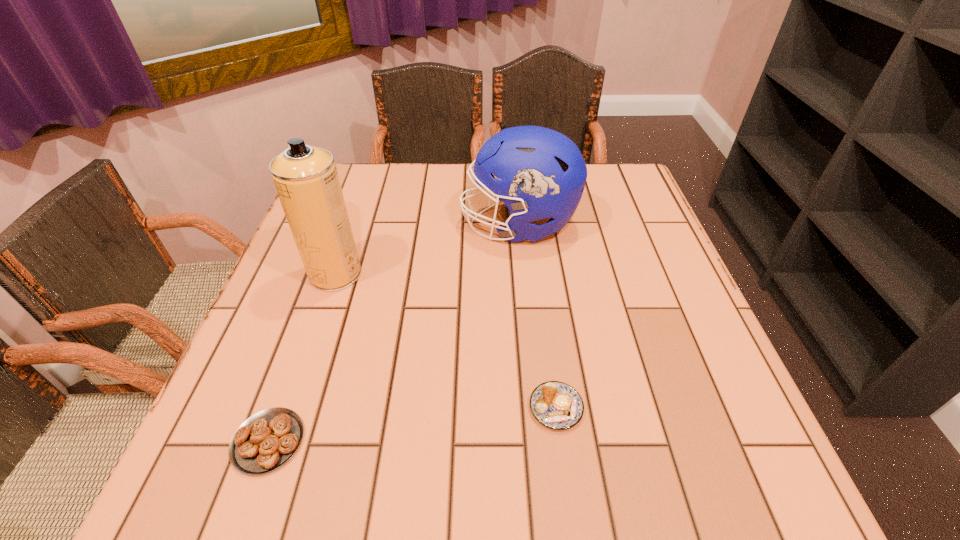
At what (x,y) coordinates should I click in order to perform the action: click on free space between the third shortest object and the left pastry. Please return your answer as a coordinate pair (x, y). Looking at the image, I should click on (394, 333).

This screenshot has width=960, height=540. What are the coordinates of `empty location between the third nearest object and the right pastry` in the screenshot? It's located at (445, 341).

Find the location of a particular element. The height and width of the screenshot is (540, 960). free spot between the left pastry and the right pastry is located at coordinates (412, 424).

Identify which object is the third closest to the left pastry. Please provide its 2D coordinates. Your answer should be formatted as a tuple, i.e. [(x, y)], where the tuple contains the x and y coordinates of a point satisfying the conditions above.

[(543, 174)]

Where is `the second closest object to the right pastry`? The width and height of the screenshot is (960, 540). the second closest object to the right pastry is located at coordinates (265, 441).

The height and width of the screenshot is (540, 960). Identify the location of vacant space that satisfies the following two spatial constraints: 1. on the front-facing side of the farthest object; 2. on the front side of the tallest object. (523, 274).

The width and height of the screenshot is (960, 540). I want to click on vacant area that satisfies the following two spatial constraints: 1. on the front-facing side of the farthest object; 2. on the back side of the right pastry, so click(538, 408).

Locate an element on the screen. Image resolution: width=960 pixels, height=540 pixels. vacant area that satisfies the following two spatial constraints: 1. on the front side of the second farthest object; 2. on the right side of the right pastry is located at coordinates (290, 408).

Where is `vacant space that satisfies the following two spatial constraints: 1. on the front-facing side of the farthest object; 2. on the left side of the right pastry`? The image size is (960, 540). vacant space that satisfies the following two spatial constraints: 1. on the front-facing side of the farthest object; 2. on the left side of the right pastry is located at coordinates (538, 408).

At what (x,y) coordinates should I click in order to perform the action: click on free space that satisfies the following two spatial constraints: 1. on the front-facing side of the farthest object; 2. on the left side of the right pastry. Please return your answer as a coordinate pair (x, y). This screenshot has height=540, width=960. Looking at the image, I should click on (538, 408).